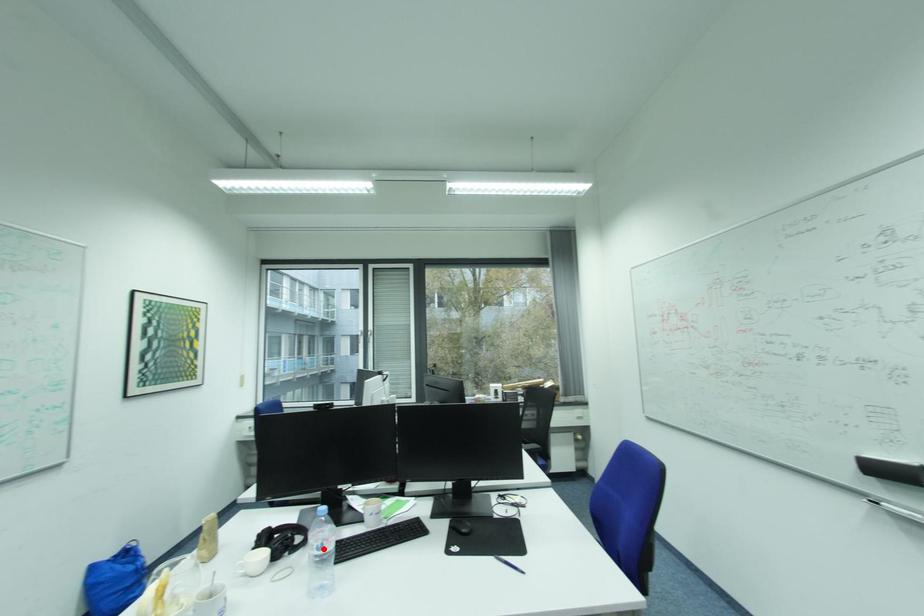
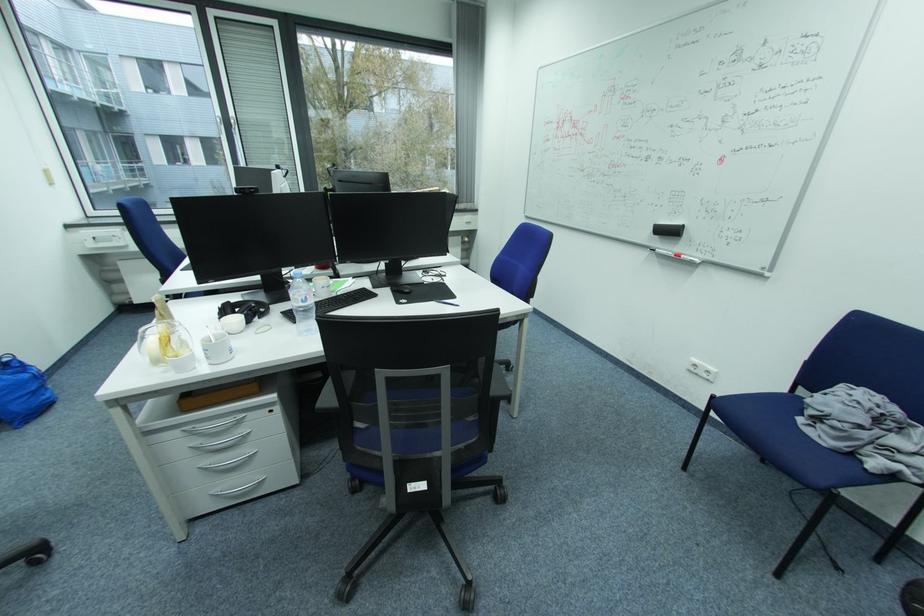
Question: I am providing you with two images of the same scene from different viewpoints. A red point is marked on the first image. At the location where the point appears in image 1, is it still visible in image 2?

Choices:
 (A) Yes
 (B) No

Answer: (A)